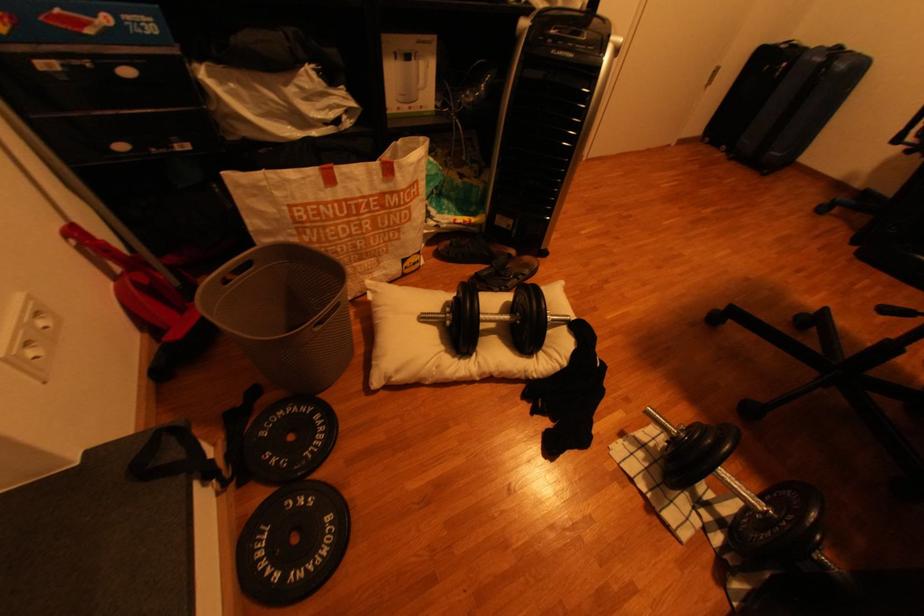
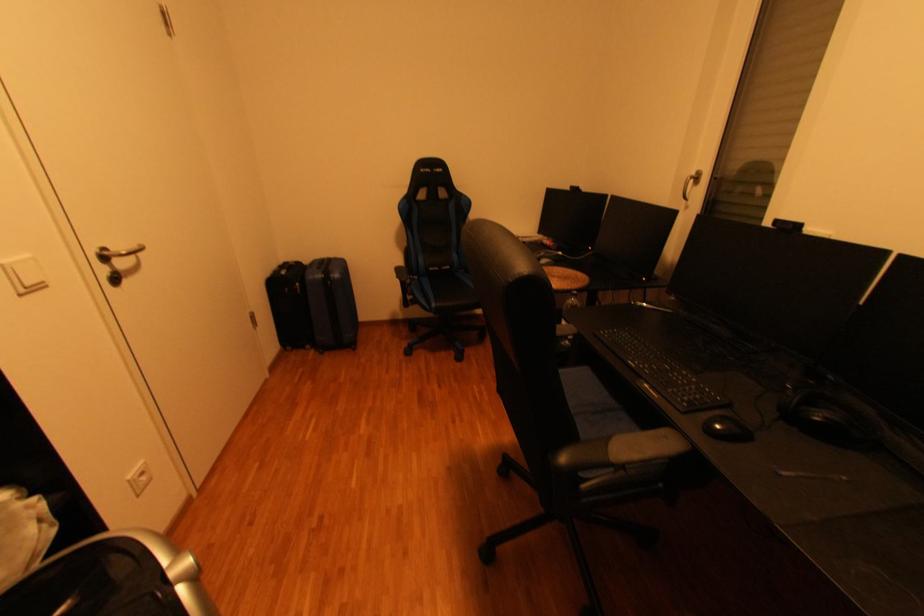
Question: The camera is either moving clockwise (left) or counter-clockwise (right) around the object. The first image is from the beginning of the video and the second image is from the end. Is the camera moving left or right when shooting the video?

Choices:
 (A) Left
 (B) Right

Answer: (A)